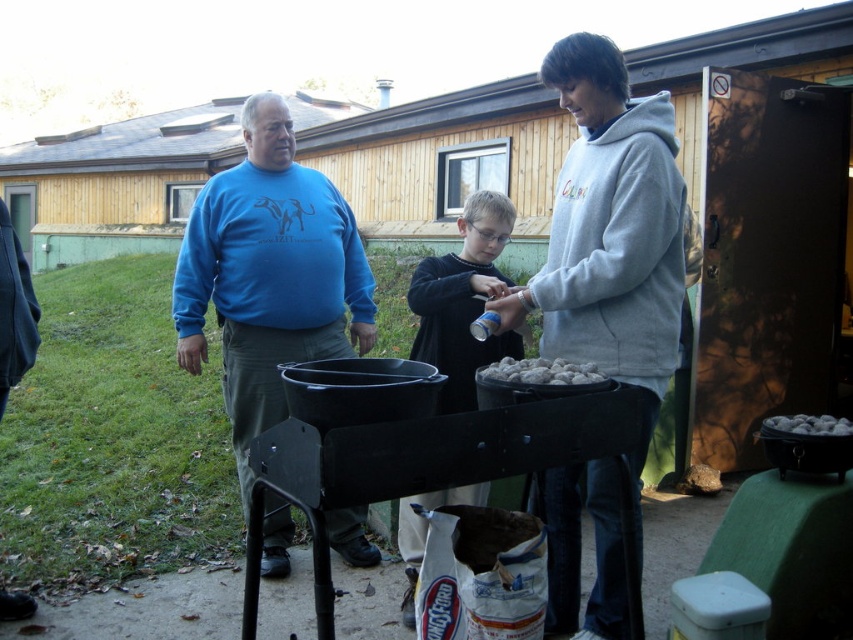
Is gray fleece hoodie at center bigger than white pebbles at center?

Yes, gray fleece hoodie at center is bigger than white pebbles at center.

Is gray fleece hoodie at center closer to the viewer compared to white pebbles at center?

No, it is behind white pebbles at center.

The width and height of the screenshot is (853, 640). What are the coordinates of `gray fleece hoodie at center` in the screenshot? It's located at (610, 232).

Does blue cotton shirt at center appear over gray matte rocks at lower right?

Indeed, blue cotton shirt at center is positioned over gray matte rocks at lower right.

Which is above, blue cotton shirt at center or gray matte rocks at lower right?

blue cotton shirt at center is above.

Who is more distant from viewer, [270,364] or [814,422]?

The point [270,364] is more distant.

Locate an element on the screen. blue cotton shirt at center is located at coordinates coord(268,275).

Between gray fleece hoodie at center and dark blue sweater at center, which one appears on the right side from the viewer's perspective?

gray fleece hoodie at center is more to the right.

This screenshot has width=853, height=640. Describe the element at coordinates (610, 232) in the screenshot. I see `gray fleece hoodie at center` at that location.

The width and height of the screenshot is (853, 640). Find the location of `gray fleece hoodie at center`. gray fleece hoodie at center is located at coordinates (610, 232).